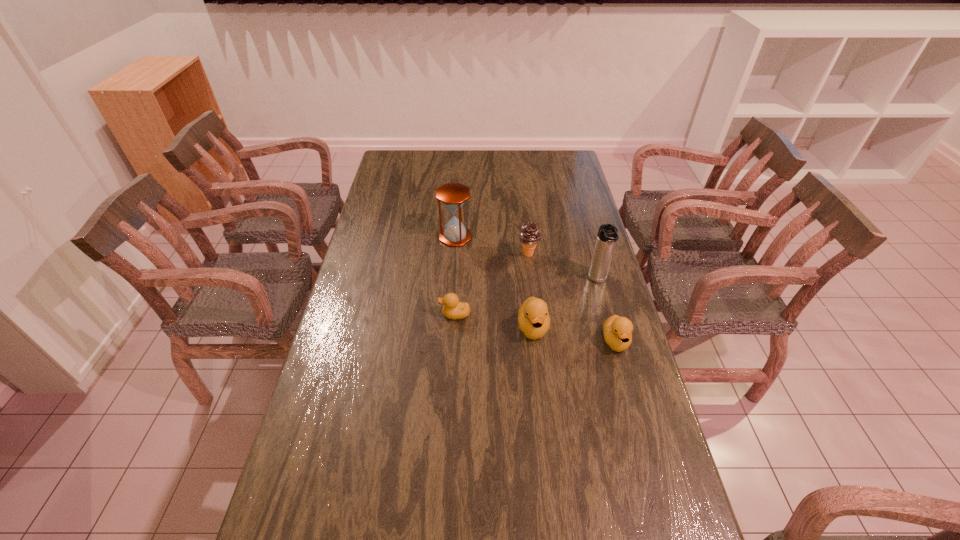
Image resolution: width=960 pixels, height=540 pixels. In order to click on vacant space situated on the face of the leftmost duckling in this screenshot , I will do `click(415, 314)`.

The height and width of the screenshot is (540, 960). Identify the location of vacant region located 0.160m on the face of the leftmost duckling. (390, 314).

Image resolution: width=960 pixels, height=540 pixels. Identify the location of free space located 0.310m on the face of the third shortest object. (546, 446).

Where is `free space located on the face of the rightmost duckling`? Image resolution: width=960 pixels, height=540 pixels. free space located on the face of the rightmost duckling is located at coordinates (626, 378).

I want to click on vacant space located 0.200m on the front of the second farthest object, so click(x=534, y=301).

This screenshot has height=540, width=960. Find the location of `vacant space located 0.160m on the left of the farthest object`. vacant space located 0.160m on the left of the farthest object is located at coordinates (398, 237).

Where is `vacant space located on the handle side of the third farthest object`? Image resolution: width=960 pixels, height=540 pixels. vacant space located on the handle side of the third farthest object is located at coordinates (620, 363).

The width and height of the screenshot is (960, 540). What are the coordinates of `duckling located at the right edge` in the screenshot? It's located at (x=617, y=330).

The width and height of the screenshot is (960, 540). Identify the location of thermos bottle located at the right edge. (607, 236).

At what (x,y) coordinates should I click in order to perform the action: click on vacant position at the far edge of the desktop. Please return your answer as a coordinate pair (x, y). This screenshot has width=960, height=540. Looking at the image, I should click on (498, 176).